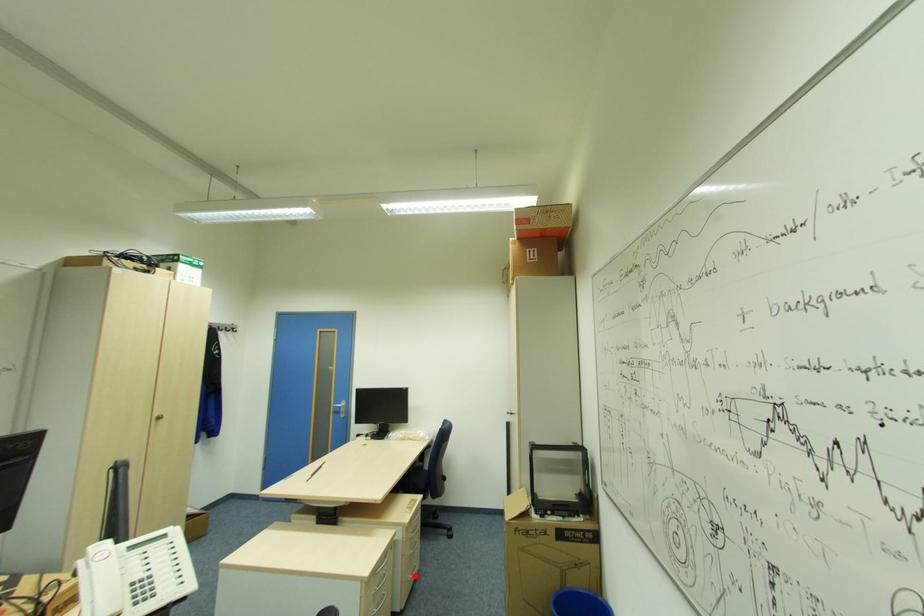
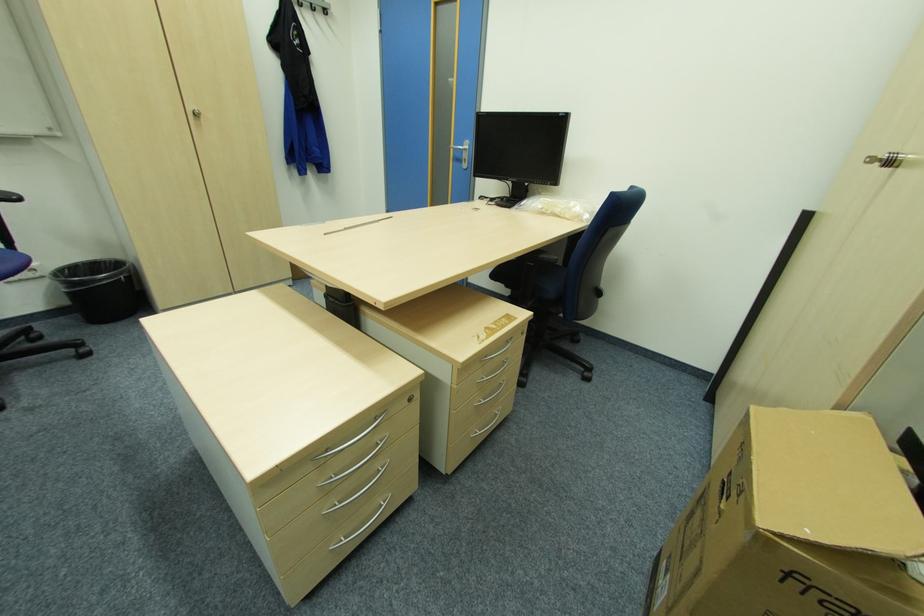
Locate, in the second image, the point that corresponds to the highlighted location in the first image.

(482, 432)